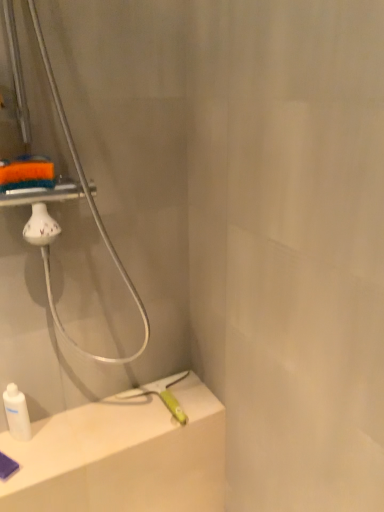
I want to click on blank space above white matte counter top at lower left (from a real-world perspective), so click(x=95, y=426).